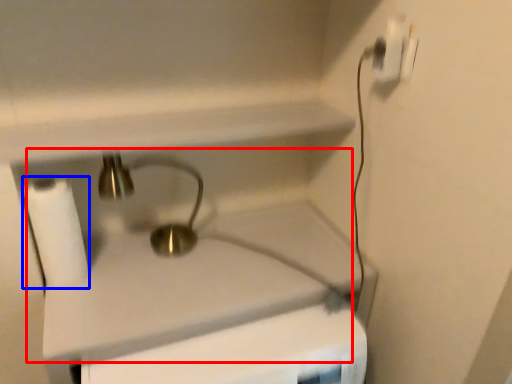
Question: Among these objects, which one is nearest to the camera, sink (highlighted by a red box) or toilet paper (highlighted by a blue box)?

Choices:
 (A) sink
 (B) toilet paper

Answer: (A)